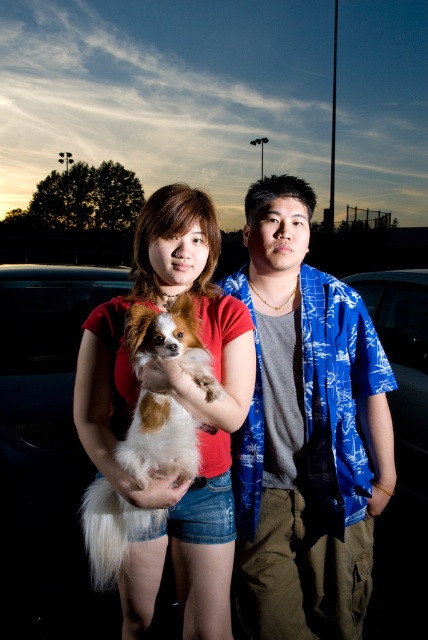
Question: In this image, where is blue printed shirt at center located relative to white fluffy dog at center?

Choices:
 (A) above
 (B) below

Answer: (A)

Question: Is blue printed shirt at center closer to camera compared to white fluffy dog at center?

Choices:
 (A) yes
 (B) no

Answer: (B)

Question: Which point is farther to the camera?

Choices:
 (A) (243, 508)
 (B) (101, 513)

Answer: (A)

Question: Is blue printed shirt at center to the left of white fluffy dog at center from the viewer's perspective?

Choices:
 (A) yes
 (B) no

Answer: (B)